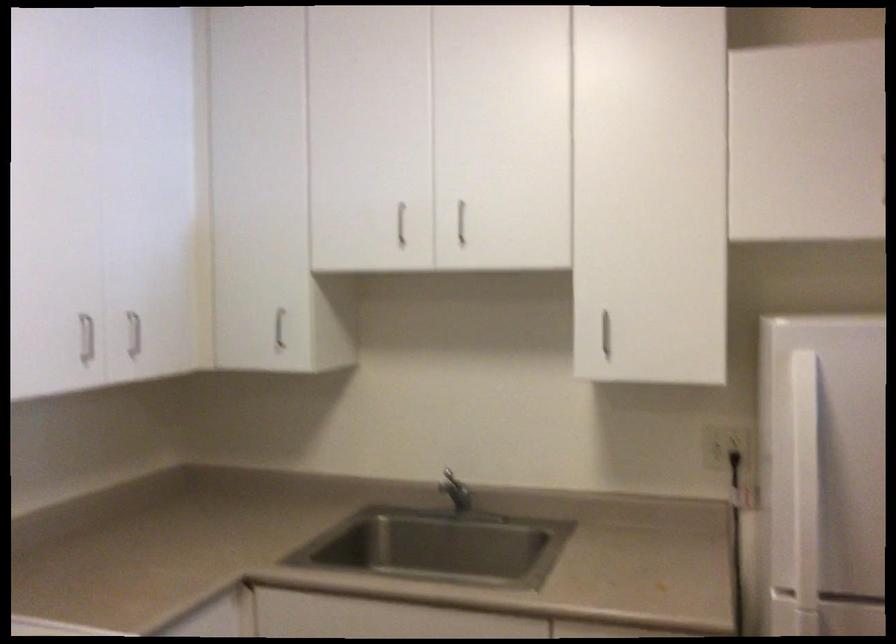
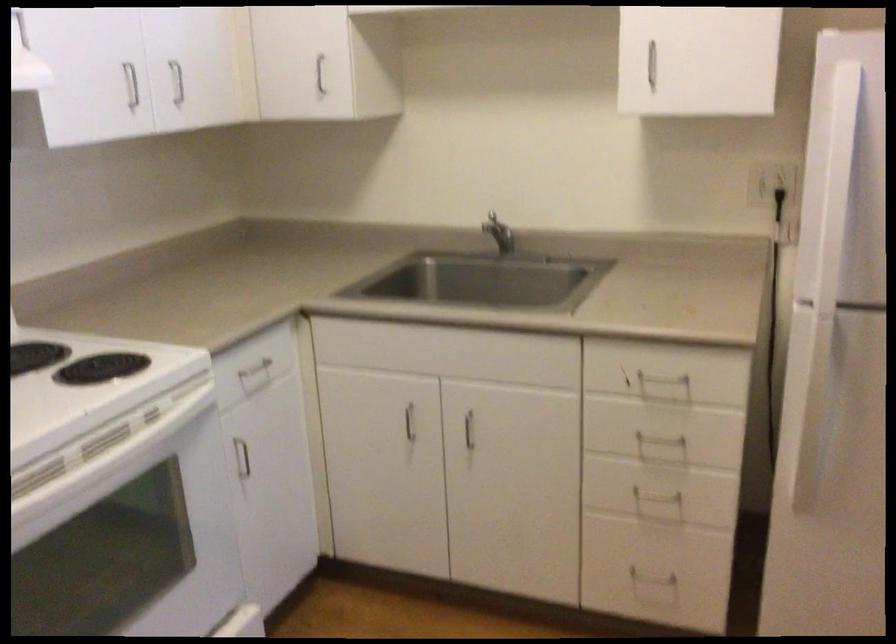
In a continuous first-person perspective shot, in which direction is the camera moving?

The cameraman moved toward right, backward.